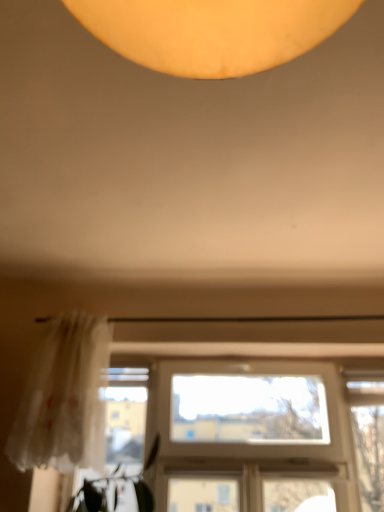
Identify the location of translucent white curtain at left. Image resolution: width=384 pixels, height=512 pixels. (64, 399).

This screenshot has height=512, width=384. What do you see at coordinates (64, 399) in the screenshot? I see `translucent white curtain at left` at bounding box center [64, 399].

Describe the element at coordinates (260, 433) in the screenshot. The image size is (384, 512). I see `clear glass window at center` at that location.

In order to face clear glass window at center, should I rotate leftwards or rightwards?

Turn right by 5.344 degrees to look at clear glass window at center.

Find the location of a particular element. This screenshot has height=512, width=384. clear glass window at center is located at coordinates (260, 433).

Identify the location of translucent white curtain at left. This screenshot has height=512, width=384. (64, 399).

Which is more to the left, clear glass window at center or translucent white curtain at left?

translucent white curtain at left.

From the picture: Does clear glass window at center come behind translucent white curtain at left?

Yes, it is behind translucent white curtain at left.

Is point (264, 477) farther from camera compared to point (80, 426)?

Yes, it is.

From the image's perspective, between clear glass window at center and translucent white curtain at left, who is located below?

clear glass window at center is shown below in the image.

From a real-world perspective, which object stands above the other?

translucent white curtain at left is physically above.

Which of these two, clear glass window at center or translucent white curtain at left, is thinner?

clear glass window at center is thinner.

In the scene shown: Which of these two, clear glass window at center or translucent white curtain at left, stands taller?

clear glass window at center.

Considering the relative sizes of clear glass window at center and translucent white curtain at left in the image provided, is clear glass window at center bigger than translucent white curtain at left?

Indeed, clear glass window at center has a larger size compared to translucent white curtain at left.

Can we say clear glass window at center lies outside translucent white curtain at left?

Absolutely, clear glass window at center is external to translucent white curtain at left.

Is clear glass window at center next to translucent white curtain at left and touching it?

No, clear glass window at center is not next to translucent white curtain at left.

Does clear glass window at center turn towards translucent white curtain at left?

Yes, clear glass window at center is aimed at translucent white curtain at left.

At what (x,y) coordinates should I click in order to perform the action: click on window below the translucent white curtain at left (from the image's perspective). Please return your answer as a coordinate pair (x, y). Image resolution: width=384 pixels, height=512 pixels. Looking at the image, I should click on (260, 433).

Which is more to the right, translucent white curtain at left or clear glass window at center?

Positioned to the right is clear glass window at center.

Does translucent white curtain at left come behind clear glass window at center?

No.

Considering the positions of point (79, 359) and point (175, 452), is point (79, 359) closer or farther from the camera than point (175, 452)?

Point (79, 359) is closer to the camera than point (175, 452).

From the image's perspective, is translucent white curtain at left above or below clear glass window at center?

Based on their image positions, translucent white curtain at left is located above clear glass window at center.

From a real-world perspective, who is located higher, translucent white curtain at left or clear glass window at center?

From a 3D spatial view, translucent white curtain at left is above.

Is translucent white curtain at left wider or thinner than clear glass window at center?

In the image, translucent white curtain at left appears to be wider than clear glass window at center.

Consider the image. From their relative heights in the image, would you say translucent white curtain at left is taller or shorter than clear glass window at center?

translucent white curtain at left is shorter than clear glass window at center.

Between translucent white curtain at left and clear glass window at center, which one has smaller size?

Smaller between the two is translucent white curtain at left.

Which is correct: translucent white curtain at left is inside clear glass window at center, or outside of it?

translucent white curtain at left is not inside clear glass window at center, it's outside.

Is translucent white curtain at left not close to clear glass window at center?

No, there isn't a large distance between translucent white curtain at left and clear glass window at center.

Could you tell me if translucent white curtain at left is turned towards clear glass window at center?

No, translucent white curtain at left is not facing towards clear glass window at center.

Measure the distance between translucent white curtain at left and clear glass window at center.

The distance of translucent white curtain at left from clear glass window at center is 24.88 inches.

This screenshot has height=512, width=384. I want to click on curtain to the left of clear glass window at center, so pyautogui.click(x=64, y=399).

This screenshot has width=384, height=512. What are the coordinates of `curtain to the left of clear glass window at center` in the screenshot? It's located at (64, 399).

Locate an element on the screen. window on the right of the translucent white curtain at left is located at coordinates (260, 433).